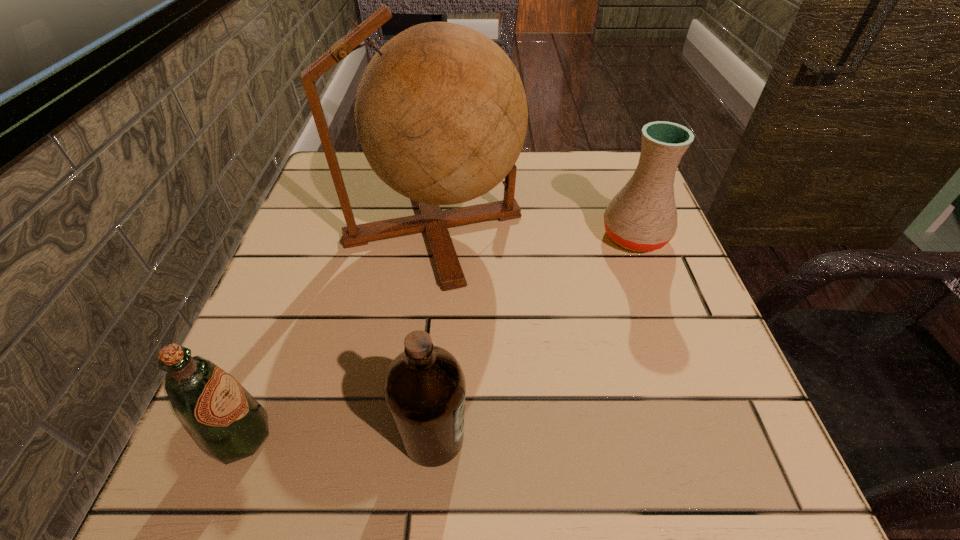
This screenshot has height=540, width=960. In order to click on olive oil that is at the left edge in this screenshot , I will do `click(228, 424)`.

Where is `object situated at the right edge`? The image size is (960, 540). object situated at the right edge is located at coordinates (642, 216).

This screenshot has width=960, height=540. Find the location of `object present at the far left corner`. object present at the far left corner is located at coordinates (441, 114).

Where is `object that is at the near left corner`? object that is at the near left corner is located at coordinates (228, 424).

You are a GUI agent. You are given a task and a screenshot of the screen. Output one action in this format:
    pyautogui.click(x=<x>, y=<y>)
    Task: Click on the free location at the far edge
    Image resolution: width=960 pixels, height=540 pixels.
    Given the screenshot: What is the action you would take?
    pyautogui.click(x=523, y=188)

At what (x,y) coordinates should I click in order to perform the action: click on vacant space at the near edge of the desktop. Please return your answer as a coordinate pair (x, y). The height and width of the screenshot is (540, 960). Looking at the image, I should click on (494, 471).

Identify the location of vacant point at the left edge. The height and width of the screenshot is (540, 960). (340, 267).

You are a GUI agent. You are given a task and a screenshot of the screen. Output one action in this format:
    pyautogui.click(x=<x>, y=<y>)
    Task: Click on the blank area at the right edge
    The height and width of the screenshot is (540, 960).
    Given the screenshot: What is the action you would take?
    pyautogui.click(x=702, y=352)

Locate an element on the screen. The width and height of the screenshot is (960, 540). vacant space at the far left corner of the desktop is located at coordinates (361, 184).

The width and height of the screenshot is (960, 540). Find the location of `vacant area at the near left corner`. vacant area at the near left corner is located at coordinates (175, 499).